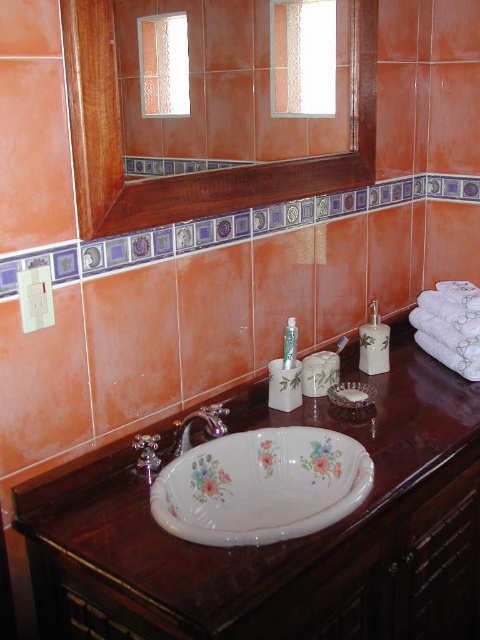
Who is higher up, wooden mirror at upper center or silver metallic faucet at center?

Positioned higher is wooden mirror at upper center.

Does wooden mirror at upper center have a greater width compared to silver metallic faucet at center?

Yes.

Is point (284, 188) farther from viewer compared to point (202, 419)?

Yes, point (284, 188) is behind point (202, 419).

Identify the location of wooden mirror at upper center. The width and height of the screenshot is (480, 640). (192, 173).

Between point (388, 358) and point (284, 337), which one is positioned behind?

The point (388, 358) is behind.

Consider the image. Which is more to the right, white glossy soap dispenser at right or white glossy toothpaste tube at center?

white glossy soap dispenser at right is more to the right.

Which is in front, point (371, 330) or point (292, 323)?

Point (292, 323) is in front.

Where is `white glossy soap dispenser at right`? The width and height of the screenshot is (480, 640). white glossy soap dispenser at right is located at coordinates (373, 342).

Is brown polished wood counter top at center to the left of silver metallic faucet at center from the viewer's perspective?

In fact, brown polished wood counter top at center is to the right of silver metallic faucet at center.

Does point (210, 589) come closer to viewer compared to point (186, 449)?

Yes, point (210, 589) is closer to viewer.

Is point (386, 534) positioned in front of point (201, 410)?

Yes.

Where is `brown polished wood counter top at center`? brown polished wood counter top at center is located at coordinates (280, 541).